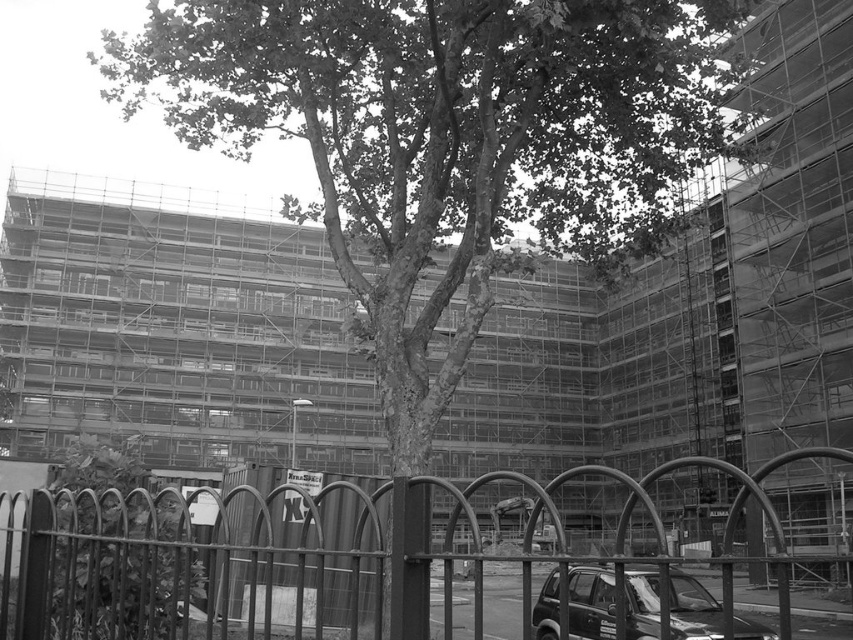
This screenshot has height=640, width=853. Describe the element at coordinates (335, 563) in the screenshot. I see `metallic wire fence at lower left` at that location.

Which of these two, metallic wire fence at lower left or shiny black suv at lower right, stands taller?

Standing taller between the two is metallic wire fence at lower left.

This screenshot has width=853, height=640. In order to click on metallic wire fence at lower left in this screenshot , I will do `click(335, 563)`.

Where is `metallic wire fence at lower left`? The image size is (853, 640). metallic wire fence at lower left is located at coordinates (335, 563).